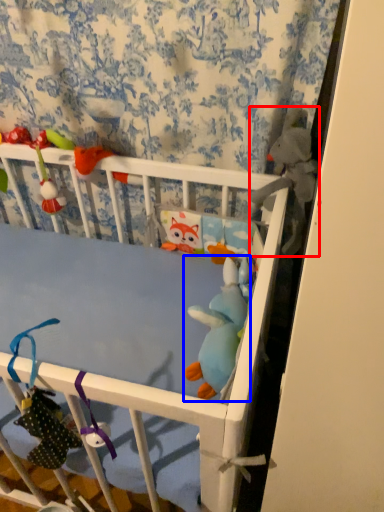
Question: Which object is closer to the camera taking this photo, toy (highlighted by a red box) or toy (highlighted by a blue box)?

Choices:
 (A) toy
 (B) toy

Answer: (B)